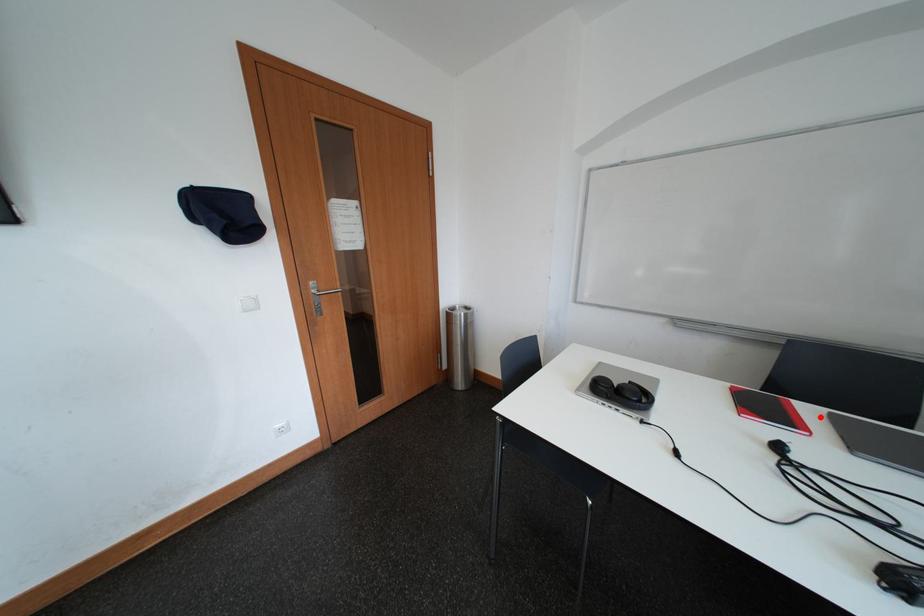
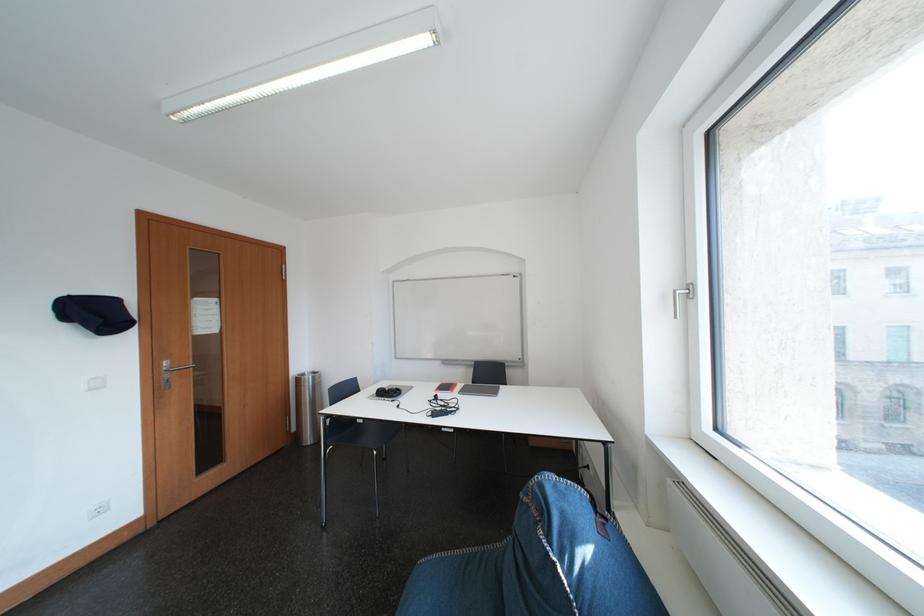
Question: I am providing you with two images of the same scene from different viewpoints. A red point is marked on the first image. At the location where the point appears in image 1, is it still visible in image 2?

Choices:
 (A) Yes
 (B) No

Answer: (A)